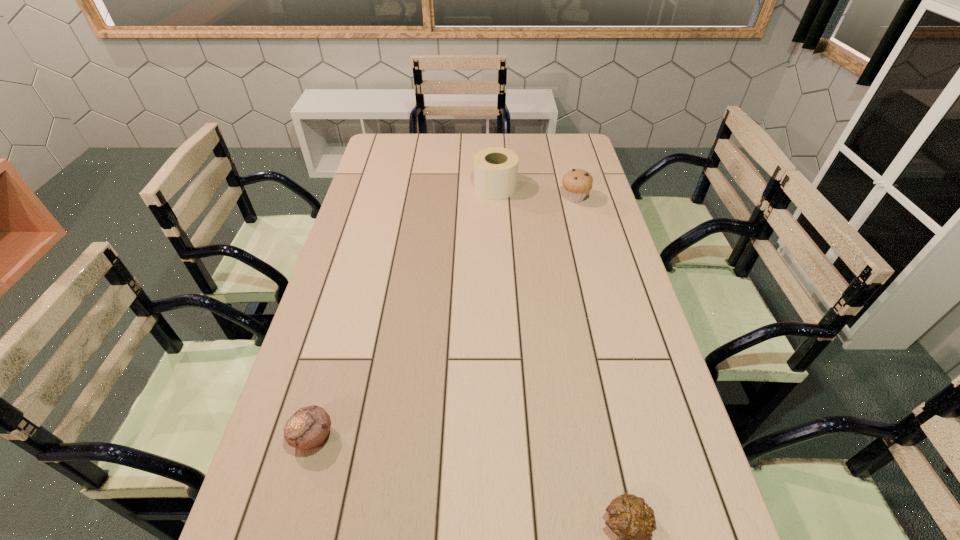
In order to click on free region at the left edge of the desktop in this screenshot , I will do `click(374, 178)`.

In the image, there is a desktop. In order to click on free space at the right edge in this screenshot , I will do `click(646, 348)`.

In the image, there is a desktop. At what (x,y) coordinates should I click in order to perform the action: click on vacant space at the far left corner. Please return your answer as a coordinate pair (x, y). The height and width of the screenshot is (540, 960). Looking at the image, I should click on (398, 152).

The width and height of the screenshot is (960, 540). In the image, there is a desktop. Find the location of `free space at the far right corner`. free space at the far right corner is located at coordinates (570, 151).

Find the location of a particular element. The image size is (960, 540). vacant space that is in between the toilet tissue and the farthest muffin is located at coordinates (535, 193).

In order to click on vacant space that is in between the second tallest muffin and the second object from left to right in this screenshot , I will do `click(404, 313)`.

This screenshot has width=960, height=540. What are the coordinates of `free area in between the second object from left to right and the tallest muffin` in the screenshot? It's located at (535, 193).

Locate an element on the screen. vacant area that lies between the leftmost object and the second tallest object is located at coordinates (444, 318).

What are the coordinates of `empty location between the toilet tissue and the second tallest object` in the screenshot? It's located at (535, 193).

Locate which object ranks third in proximity to the second shortest object. Please provide its 2D coordinates. Your answer should be formatted as a tuple, i.e. [(x, y)], where the tuple contains the x and y coordinates of a point satisfying the conditions above.

[(577, 183)]